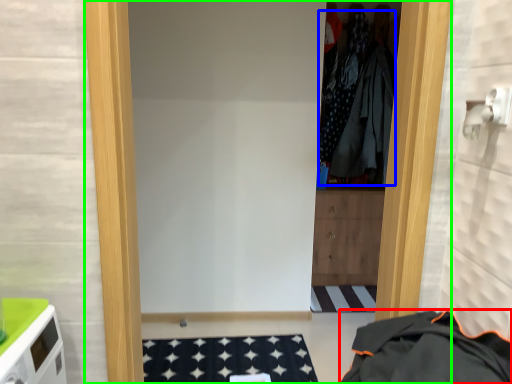
Question: Estimate the real-world distances between objects in this image. Which object is closer to clothing (highlighted by a red box), clothing (highlighted by a blue box) or door (highlighted by a green box)?

Choices:
 (A) clothing
 (B) door

Answer: (B)